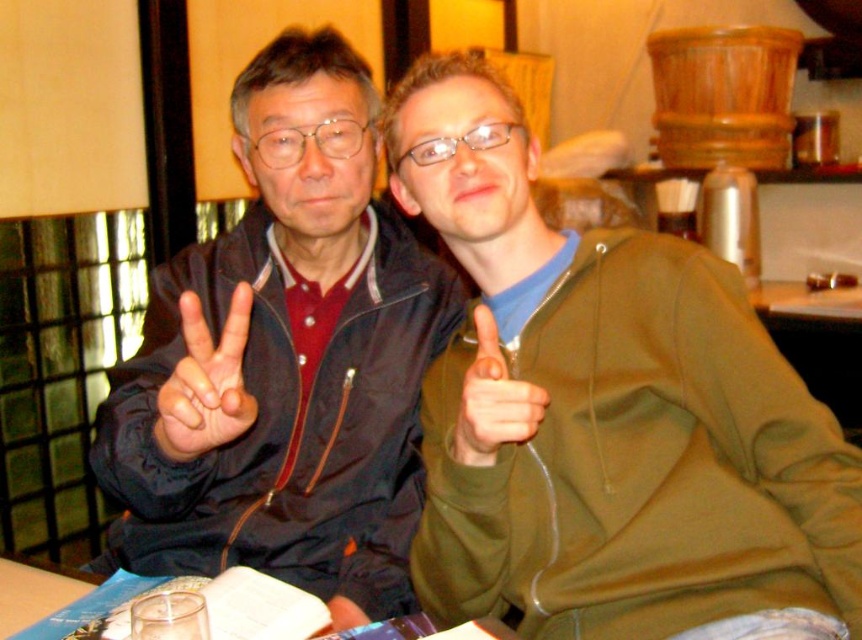
Question: Can you confirm if matte black jacket at left is positioned above matte plastic hand at center?

Choices:
 (A) no
 (B) yes

Answer: (B)

Question: Which is farther from the matte black jacket at left?

Choices:
 (A) matte green hand at center
 (B) matte black hand at center
 (C) matte plastic hand at center

Answer: (C)

Question: Is matte black hand at center behind matte green hand at center?

Choices:
 (A) no
 (B) yes

Answer: (A)

Question: Among these points, which one is nearest to the camera?

Choices:
 (A) (495, 365)
 (B) (191, 438)
 (C) (242, 148)
 (D) (332, 618)

Answer: (A)

Question: Is matte black jacket at left to the left of matte plastic hand at center from the viewer's perspective?

Choices:
 (A) yes
 (B) no

Answer: (A)

Question: Which point is closer to the camera?

Choices:
 (A) (358, 611)
 (B) (161, 452)

Answer: (B)